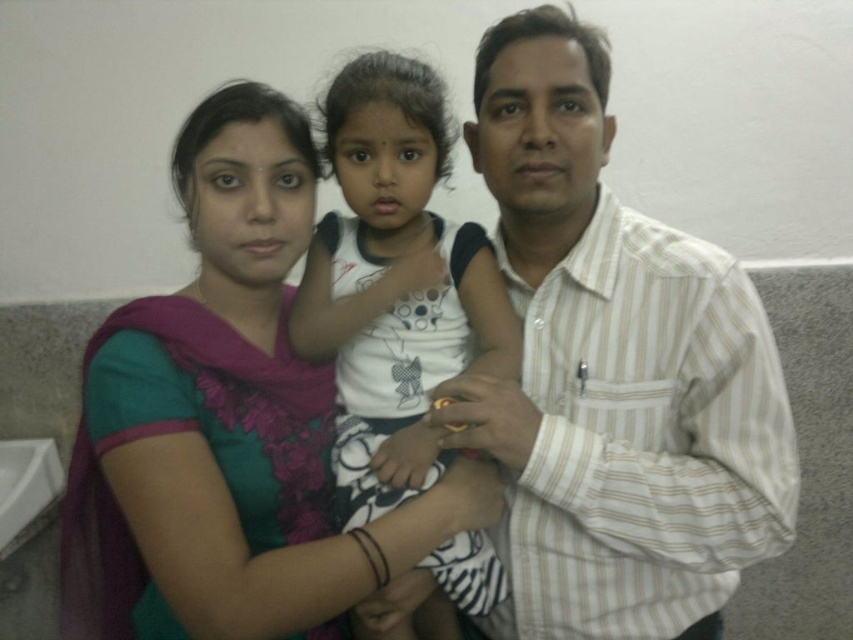
Can you confirm if white striped shirt at center is positioned to the left of white dotted shirt at center?

No, white striped shirt at center is not to the left of white dotted shirt at center.

Does white striped shirt at center have a larger size compared to white dotted shirt at center?

Yes.

Between point (538, 486) and point (389, 104), which one is positioned behind?

The point (389, 104) is more distant.

This screenshot has height=640, width=853. Identify the location of white striped shirt at center. (614, 371).

Is white striped shirt at center taller than green fabric sari at center?

Yes.

Identify the location of white striped shirt at center. (614, 371).

In order to click on white striped shirt at center in this screenshot , I will do `click(614, 371)`.

Does green fabric sari at center have a larger size compared to white dotted shirt at center?

Yes, green fabric sari at center is bigger than white dotted shirt at center.

Does point (109, 515) lie behind point (457, 605)?

Yes, it is.

Identify the location of green fabric sari at center. The width and height of the screenshot is (853, 640). (228, 422).